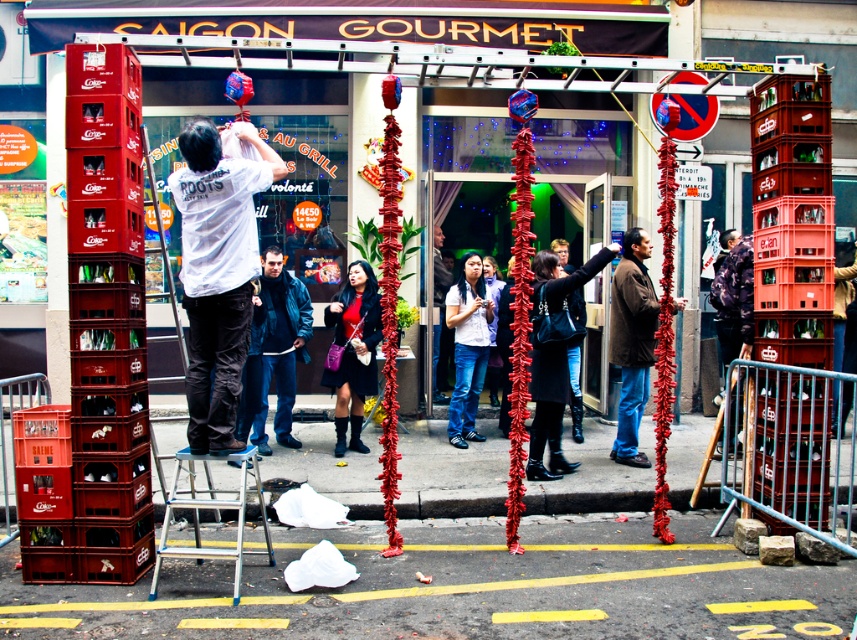
Does blue matte jacket at center have a lesser height compared to white matte shirt at center?

Indeed, blue matte jacket at center has a lesser height compared to white matte shirt at center.

Find the location of `blue matte jacket at center`. blue matte jacket at center is located at coordinates (279, 344).

Between leather jacket at center and white matte shirt at center, which one appears on the right side from the viewer's perspective?

white matte shirt at center

Is point (352, 365) positioned before point (439, 241)?

Yes, point (352, 365) is in front of point (439, 241).

Which is in front, point (346, 378) or point (433, 243)?

Point (346, 378) is more forward.

The image size is (857, 640). Find the location of `leather jacket at center`. leather jacket at center is located at coordinates (352, 349).

The width and height of the screenshot is (857, 640). In order to click on white cotton shirt at center in this screenshot , I will do `click(217, 273)`.

Does white cotton shirt at center come behind brown wool coat at center?

No, it is not.

I want to click on white cotton shirt at center, so click(x=217, y=273).

Where is `white cotton shirt at center`? This screenshot has width=857, height=640. white cotton shirt at center is located at coordinates (217, 273).